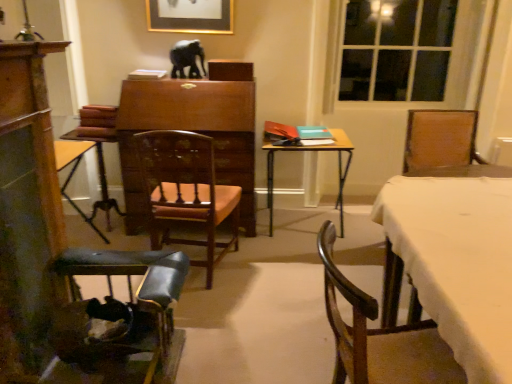
Question: Is matte gold picture frame at upper center closer to the viewer compared to shiny black elephant at center?

Choices:
 (A) yes
 (B) no

Answer: (B)

Question: From a real-world perspective, is matte gold picture frame at upper center below shiny black elephant at center?

Choices:
 (A) yes
 (B) no

Answer: (B)

Question: Considering the relative sizes of matte gold picture frame at upper center and shiny black elephant at center in the image provided, is matte gold picture frame at upper center shorter than shiny black elephant at center?

Choices:
 (A) no
 (B) yes

Answer: (A)

Question: Is matte gold picture frame at upper center oriented away from shiny black elephant at center?

Choices:
 (A) no
 (B) yes

Answer: (A)

Question: Considering the relative sizes of matte gold picture frame at upper center and shiny black elephant at center in the image provided, is matte gold picture frame at upper center taller than shiny black elephant at center?

Choices:
 (A) yes
 (B) no

Answer: (A)

Question: Can you confirm if matte gold picture frame at upper center is smaller than shiny black elephant at center?

Choices:
 (A) yes
 (B) no

Answer: (B)

Question: Can you confirm if matte gold picture frame at upper center is positioned to the right of wooden polished chair at center, the 2th chair from the left?

Choices:
 (A) yes
 (B) no

Answer: (B)

Question: Considering the relative sizes of matte gold picture frame at upper center and wooden polished chair at center, the 2th chair from the left, in the image provided, is matte gold picture frame at upper center bigger than wooden polished chair at center, the 2th chair from the left,?

Choices:
 (A) no
 (B) yes

Answer: (A)

Question: From a real-world perspective, is matte gold picture frame at upper center located higher than wooden polished chair at center, the 2th chair from the left?

Choices:
 (A) no
 (B) yes

Answer: (B)

Question: From a real-world perspective, is matte gold picture frame at upper center below wooden polished chair at center, the 2th chair from the left?

Choices:
 (A) no
 (B) yes

Answer: (A)

Question: Is matte gold picture frame at upper center smaller than wooden polished chair at center, which is the 2th chair from right to left?

Choices:
 (A) yes
 (B) no

Answer: (A)

Question: Is the depth of matte gold picture frame at upper center greater than that of wooden polished chair at center, the 2th chair from the left?

Choices:
 (A) no
 (B) yes

Answer: (B)

Question: Does shiny black elephant at center have a greater width compared to wooden chair at lower right, the third chair positioned from the left?

Choices:
 (A) no
 (B) yes

Answer: (A)